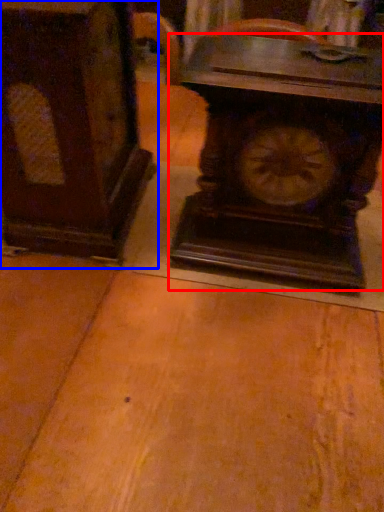
Question: Among these objects, which one is farthest to the camera, wall clock (highlighted by a red box) or furniture (highlighted by a blue box)?

Choices:
 (A) wall clock
 (B) furniture

Answer: (A)